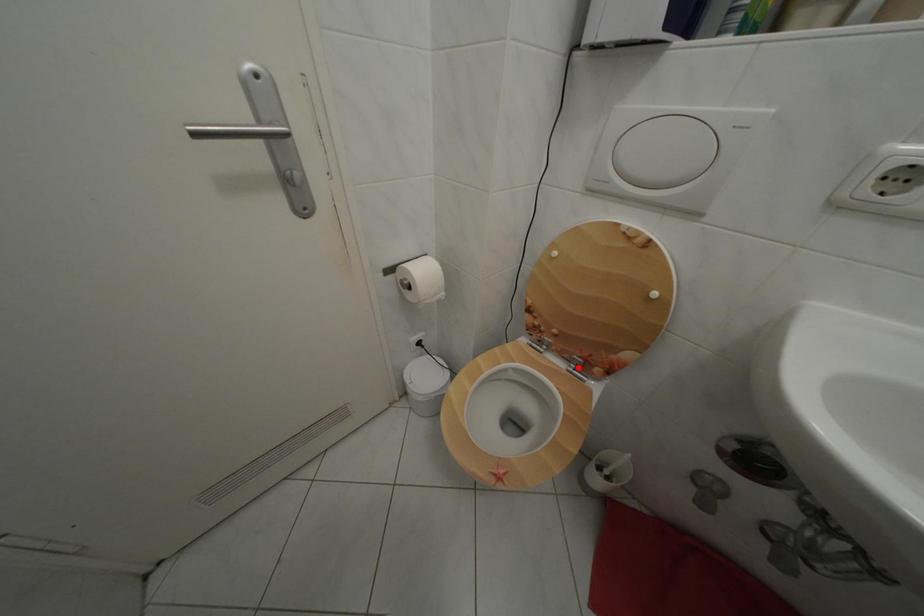
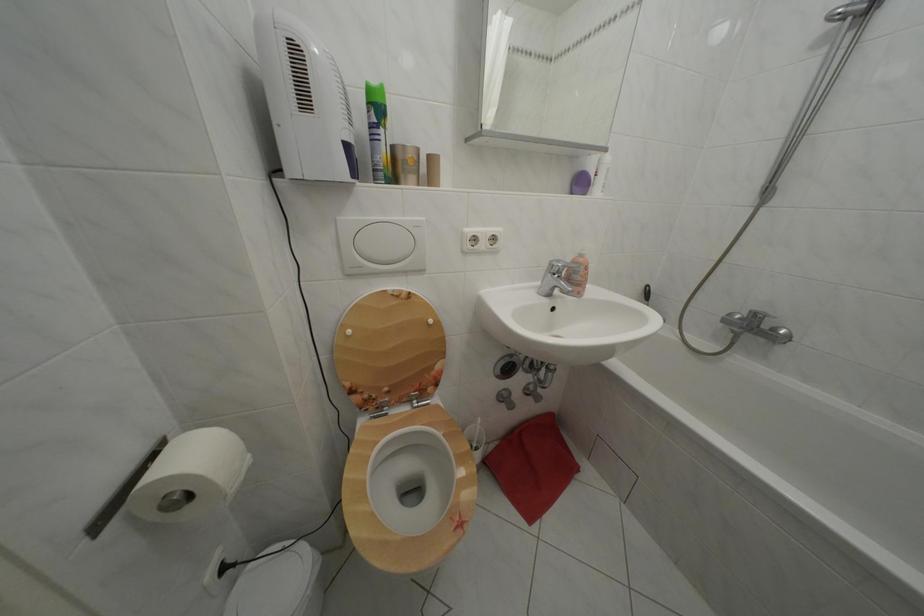
Question: I am providing you with two images of the same scene from different viewpoints. In image1, a red point is highlighted. Considering the same 3D point in image2, which of the following is correct?

Choices:
 (A) It is closer
 (B) It is farther

Answer: (B)